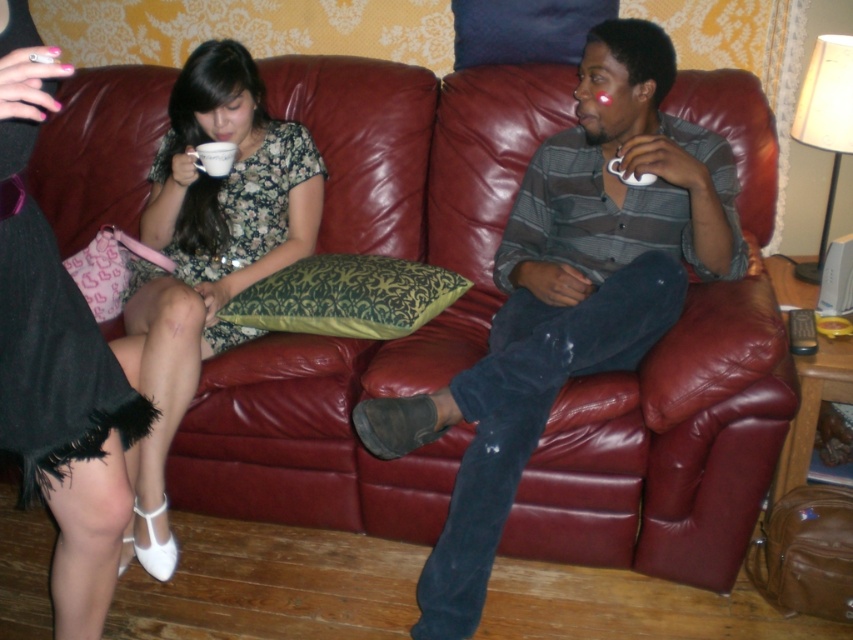
Question: Is matte striped shirt at center in front of matte ceramic cup at upper left?

Choices:
 (A) no
 (B) yes

Answer: (B)

Question: Estimate the real-world distances between objects in this image. Which object is farther from the matte ceramic cup at upper left?

Choices:
 (A) matte striped shirt at center
 (B) matte floral dress at center

Answer: (A)

Question: Does matte floral dress at center appear on the right side of matte ceramic cup at upper left?

Choices:
 (A) yes
 (B) no

Answer: (B)

Question: Observing the image, what is the correct spatial positioning of floral dress at left in reference to matte floral dress at center?

Choices:
 (A) right
 (B) left

Answer: (A)

Question: Considering the real-world distances, which object is farthest from the matte striped shirt at center?

Choices:
 (A) floral dress at left
 (B) matte ceramic cup at upper left

Answer: (B)

Question: Which object appears farthest from the camera in this image?

Choices:
 (A) matte striped shirt at center
 (B) matte ceramic cup at upper left
 (C) matte floral dress at center
 (D) floral dress at left

Answer: (B)